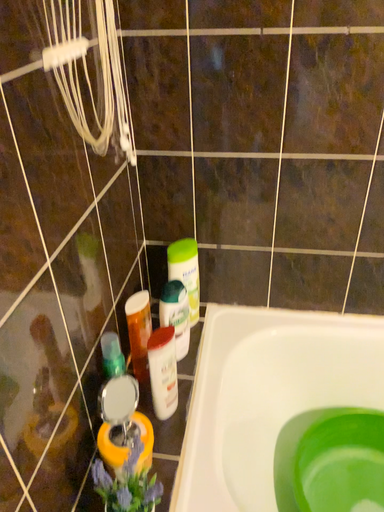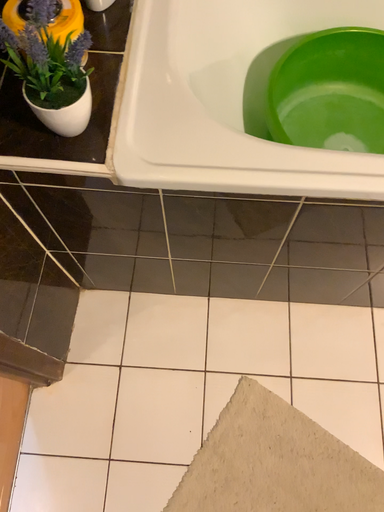
Question: Which way did the camera rotate in the video?

Choices:
 (A) rotated downward
 (B) rotated upward

Answer: (A)